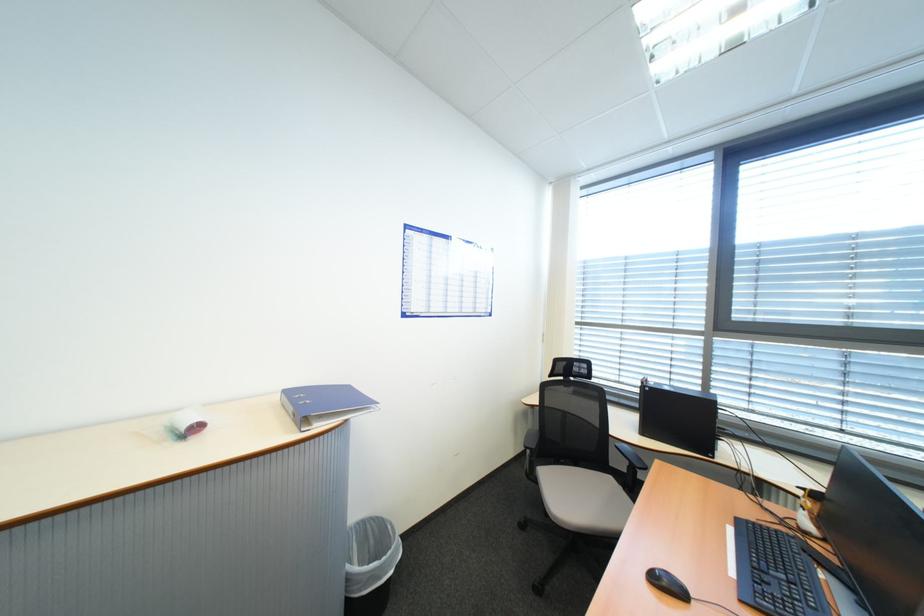
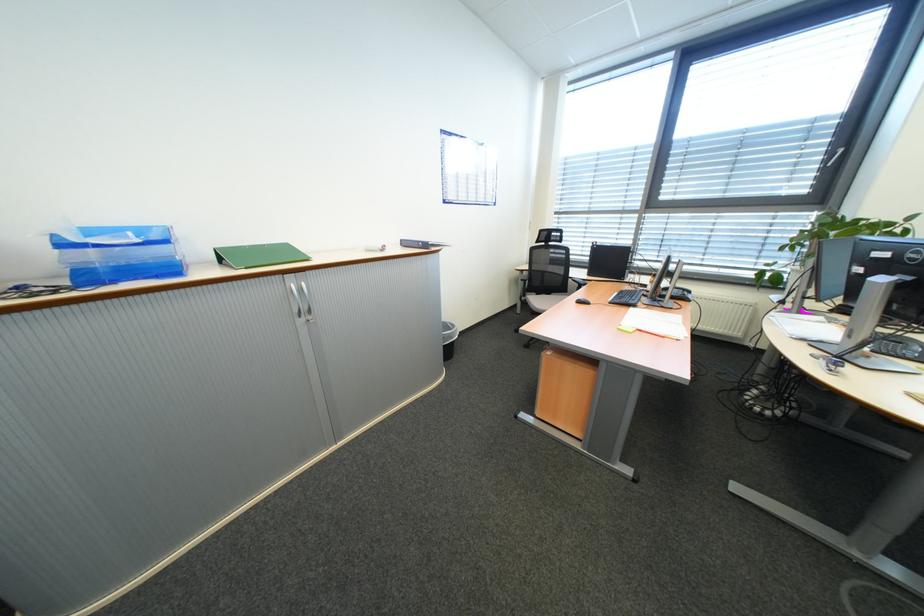
Locate, in the second image, the point that corresponds to (744,576) in the first image.

(619, 302)